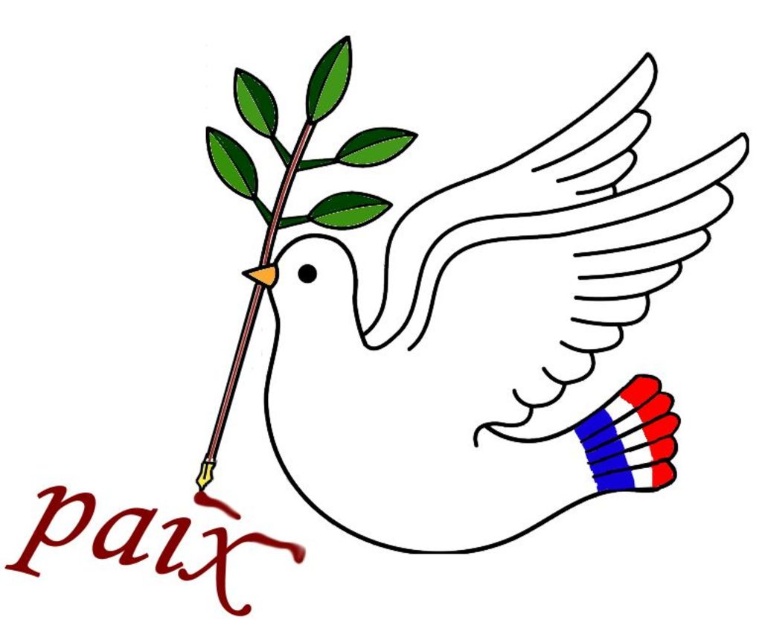
You are a photographer standing at a certain distance from the white matte dove at center. Your camera has a focal length of 50mm and you want to capture the dove in focus while keeping the background slightly blurred. Given that the minimum focusing distance for your camera is 1 meter, can you adjust your position to achieve this effect?

The distance between you and the white matte dove at center is 1.13 meters, which is beyond the camera minimum focusing distance of 1 meter. Therefore, you can adjust your position to focus on the dove while keeping the background blurred.

You are an art curator planning an exhibition about symbols of peace. You have a painting featuring a white matte dove at center and a green leafy branch at center. The dove is positioned in the center of the canvas. Considering the size relationship between the two objects, which one do you think will be more visually dominant in the artwork?

The white matte dove at center has a larger size compared to the green leafy branch at center, making it the more visually dominant element in the artwork.

You are a photographer adjusting your camera to focus on two points in the image. The first point is at coordinates point (415, 305) and the second is at point (274, 220). Which point should you focus on first if you want to capture the closest object to the camera?

Point (274, 220) is closer to the camera than point (415, 305), so you should focus on point (274, 220) first to capture the closest object.